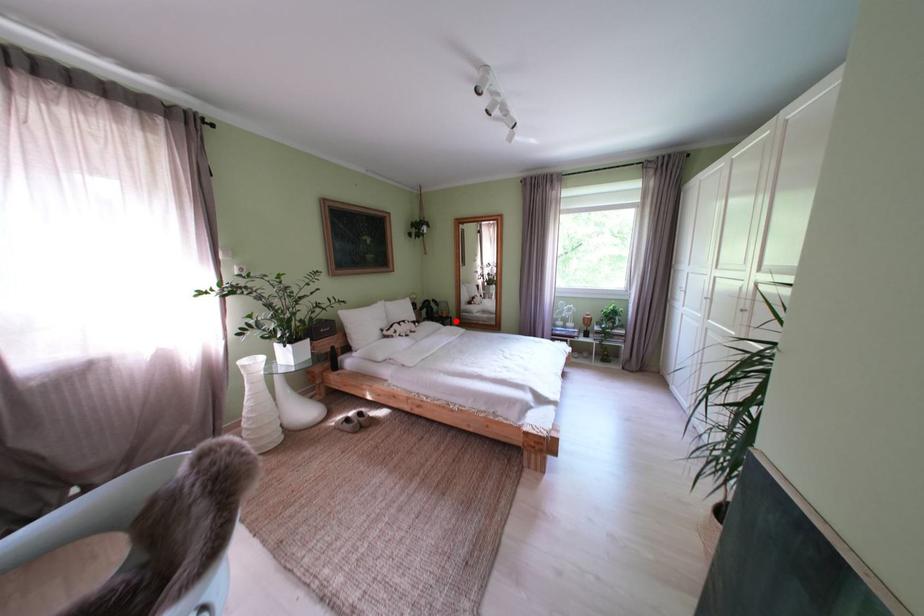
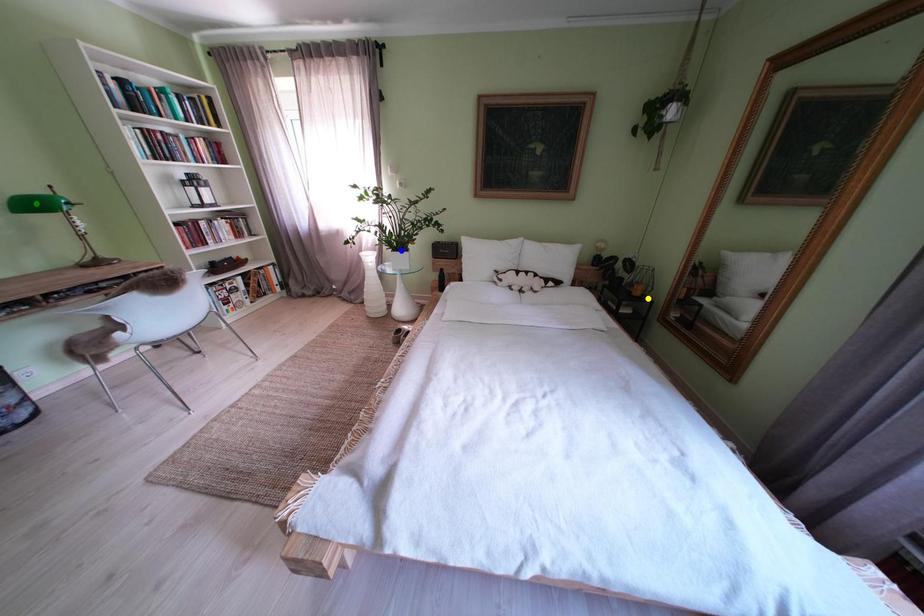
Question: I am providing you with two images of the same scene from different viewpoints. A red point is marked on the first image. You are given multiple points on the second image. In image 2, which mark is for the same physical point as the one in image 1?

Choices:
 (A) blue point
 (B) yellow point
 (C) green point

Answer: (B)